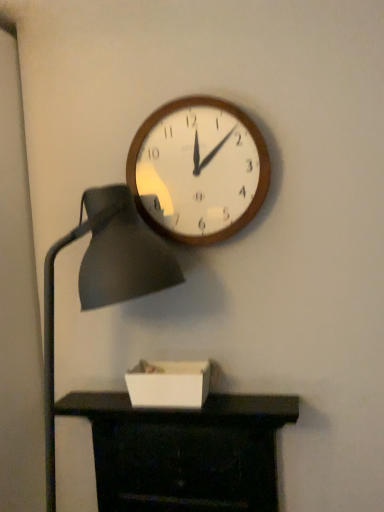
Question: Is matte black lampshade at left completely or partially outside of white matte box at lower center?

Choices:
 (A) no
 (B) yes

Answer: (B)

Question: From the image's perspective, is matte black lampshade at left on top of white matte box at lower center?

Choices:
 (A) yes
 (B) no

Answer: (A)

Question: Does matte black lampshade at left have a lesser height compared to white matte box at lower center?

Choices:
 (A) yes
 (B) no

Answer: (B)

Question: Could you tell me if matte black lampshade at left is turned towards white matte box at lower center?

Choices:
 (A) yes
 (B) no

Answer: (A)

Question: Considering the relative sizes of matte black lampshade at left and white matte box at lower center in the image provided, is matte black lampshade at left thinner than white matte box at lower center?

Choices:
 (A) no
 (B) yes

Answer: (A)

Question: From a real-world perspective, is matte black lampshade at left on white matte box at lower center?

Choices:
 (A) yes
 (B) no

Answer: (A)

Question: Does matte black fireplace at lower center have a greater height compared to white matte box at lower center?

Choices:
 (A) no
 (B) yes

Answer: (B)

Question: Considering the relative sizes of matte black fireplace at lower center and white matte box at lower center in the image provided, is matte black fireplace at lower center bigger than white matte box at lower center?

Choices:
 (A) no
 (B) yes

Answer: (B)

Question: Is matte black fireplace at lower center at the left side of white matte box at lower center?

Choices:
 (A) no
 (B) yes

Answer: (B)

Question: From a real-world perspective, is matte black fireplace at lower center on white matte box at lower center?

Choices:
 (A) yes
 (B) no

Answer: (B)

Question: Can you confirm if matte black fireplace at lower center is wider than white matte box at lower center?

Choices:
 (A) yes
 (B) no

Answer: (A)

Question: Are matte black fireplace at lower center and white matte box at lower center beside each other?

Choices:
 (A) no
 (B) yes

Answer: (A)

Question: Considering the relative sizes of white matte box at lower center and matte black fireplace at lower center in the image provided, is white matte box at lower center shorter than matte black fireplace at lower center?

Choices:
 (A) no
 (B) yes

Answer: (B)